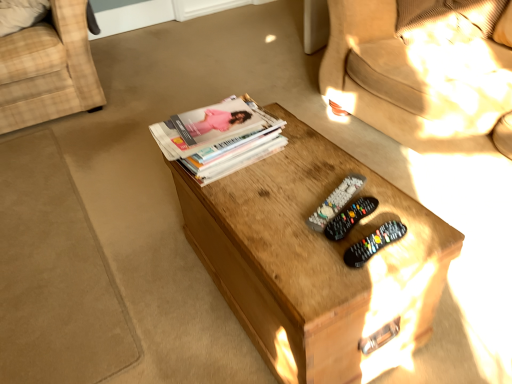
The height and width of the screenshot is (384, 512). I want to click on unoccupied region to the right of black plastic remote controls at center, which ranks as the first remote control in front-to-back order, so click(418, 235).